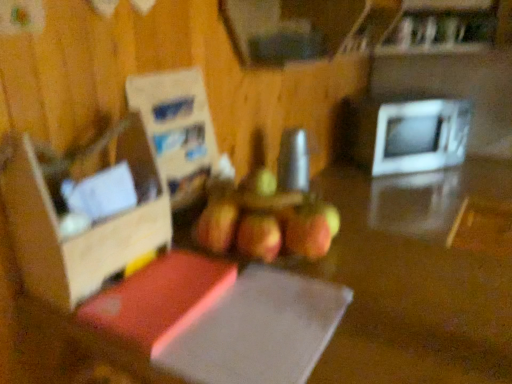
Question: Is cardboard box at left beside white glossy microwave at right?

Choices:
 (A) no
 (B) yes

Answer: (A)

Question: From the image's perspective, is cardboard box at left above white glossy microwave at right?

Choices:
 (A) no
 (B) yes

Answer: (A)

Question: Can you confirm if cardboard box at left is bigger than white glossy microwave at right?

Choices:
 (A) yes
 (B) no

Answer: (B)

Question: Would you say cardboard box at left is outside white glossy microwave at right?

Choices:
 (A) no
 (B) yes

Answer: (B)

Question: From the image's perspective, is cardboard box at left under white glossy microwave at right?

Choices:
 (A) no
 (B) yes

Answer: (B)

Question: Is white glossy microwave at right wider or thinner than ripe red apple at center?

Choices:
 (A) wide
 (B) thin

Answer: (A)

Question: Based on their sizes in the image, would you say white glossy microwave at right is bigger or smaller than ripe red apple at center?

Choices:
 (A) small
 (B) big

Answer: (B)

Question: In the image, is white glossy microwave at right positioned in front of or behind ripe red apple at center?

Choices:
 (A) front
 (B) behind

Answer: (B)

Question: From their relative heights in the image, would you say white glossy microwave at right is taller or shorter than ripe red apple at center?

Choices:
 (A) short
 (B) tall

Answer: (B)

Question: Is cardboard box at left taller or shorter than ripe red apple at center?

Choices:
 (A) tall
 (B) short

Answer: (A)

Question: Looking at the image, does cardboard box at left seem bigger or smaller compared to ripe red apple at center?

Choices:
 (A) big
 (B) small

Answer: (B)

Question: From the image's perspective, is cardboard box at left positioned above or below ripe red apple at center?

Choices:
 (A) below
 (B) above

Answer: (B)

Question: Is cardboard box at left in front of or behind ripe red apple at center in the image?

Choices:
 (A) front
 (B) behind

Answer: (A)

Question: Considering the positions of ripe red apple at center and cardboard box at left in the image, is ripe red apple at center bigger or smaller than cardboard box at left?

Choices:
 (A) big
 (B) small

Answer: (A)

Question: From the image's perspective, relative to cardboard box at left, is ripe red apple at center above or below?

Choices:
 (A) below
 (B) above

Answer: (A)